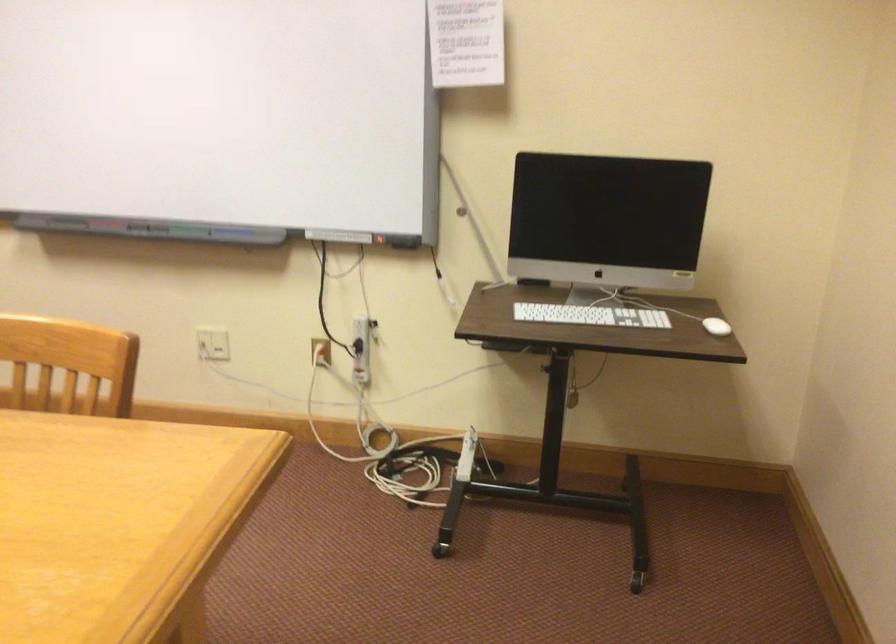
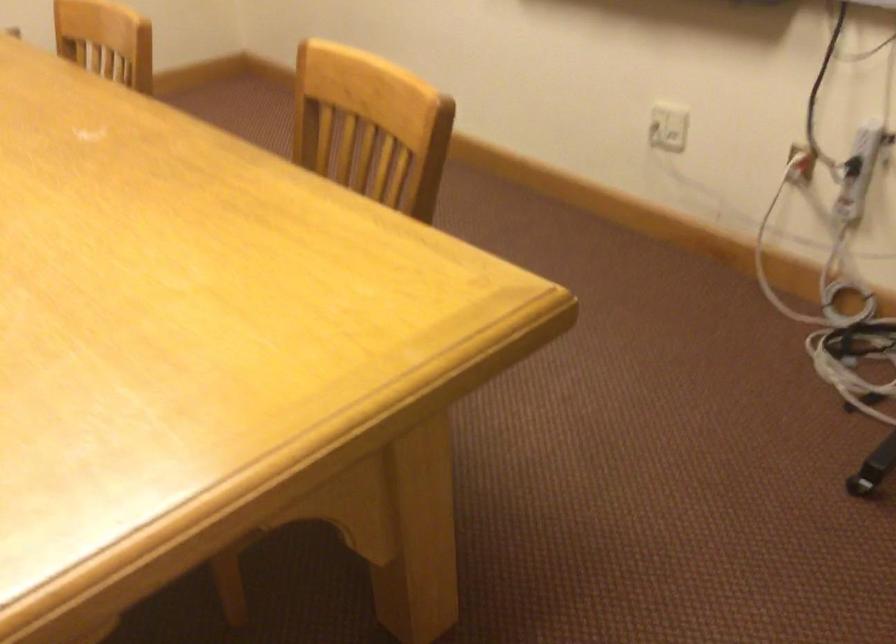
The point at (207,344) is marked in the first image. Where is the corresponding point in the second image?

(668, 127)